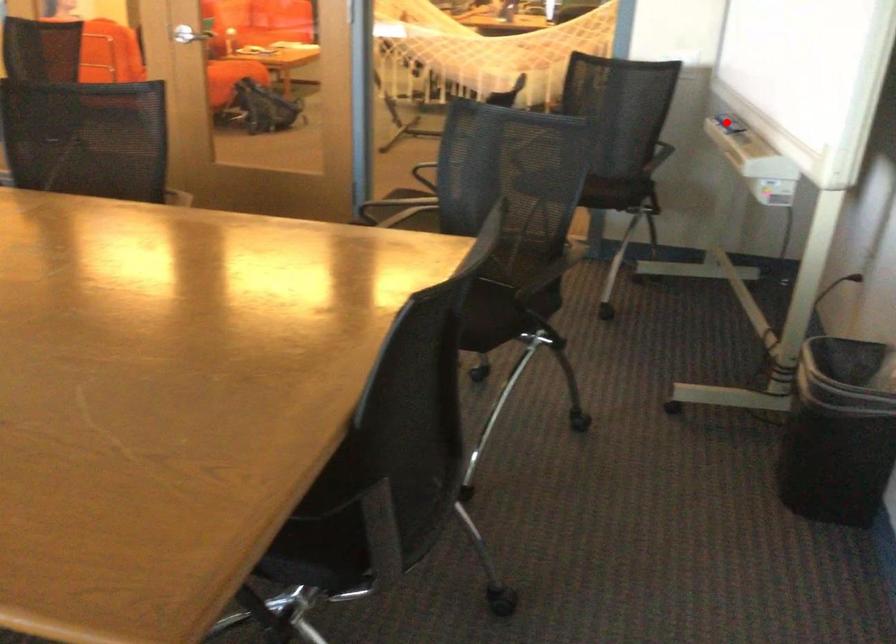
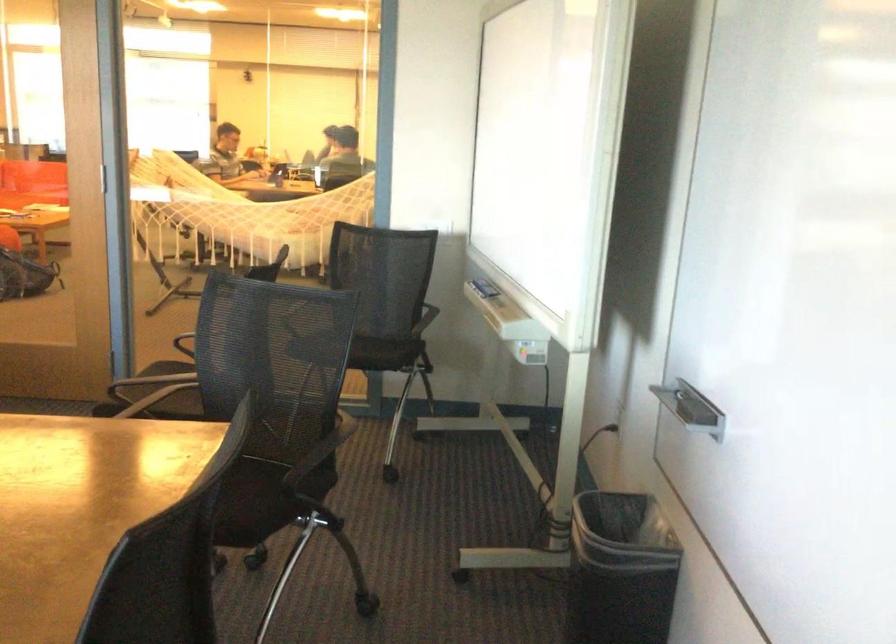
Locate, in the second image, the point that corresponds to the highlighted location in the first image.

(484, 288)